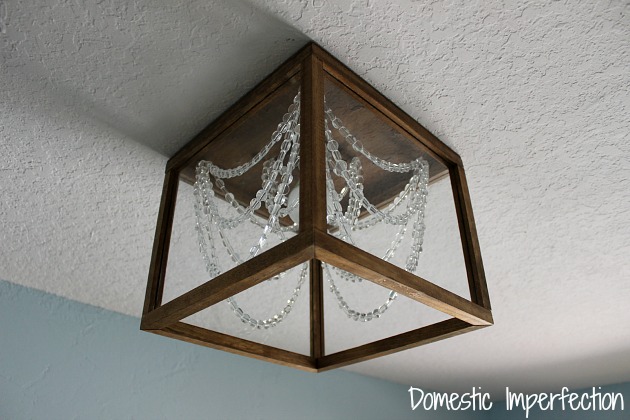
Locate an element on the screen. wall is located at coordinates [x=106, y=380], [x=556, y=412].